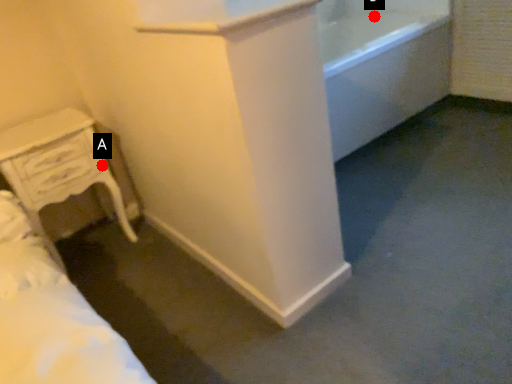
Question: Two points are circled on the image, labeled by A and B beside each circle. Which of the following is the closest to the observer?

Choices:
 (A) A is closer
 (B) B is closer

Answer: (A)